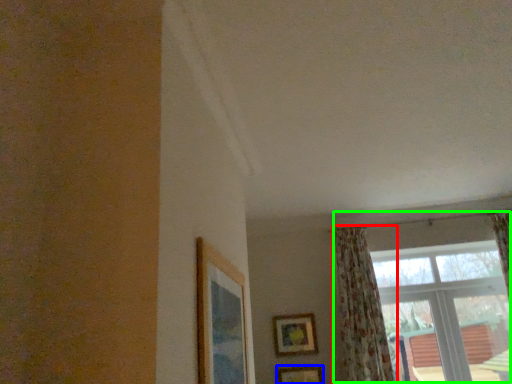
Question: Estimate the real-world distances between objects in this image. Which object is closer to curtain (highlighted by a red box), picture frame (highlighted by a blue box) or window (highlighted by a green box)?

Choices:
 (A) picture frame
 (B) window

Answer: (B)